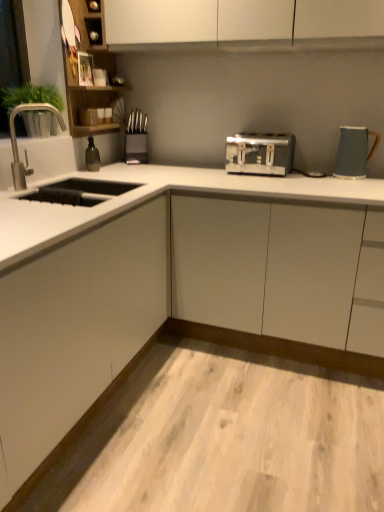
Question: From the image's perspective, is satin silver toaster at center located above or below white laminate countertop at lower center?

Choices:
 (A) above
 (B) below

Answer: (A)

Question: Is point (269, 157) positioned closer to the camera than point (36, 430)?

Choices:
 (A) closer
 (B) farther

Answer: (B)

Question: Which is nearer to the wooden cabinet at upper left?

Choices:
 (A) satin silver toaster at center
 (B) metallic knife block at center
 (C) silver metallic faucet at left
 (D) white laminate countertop at lower center
 (E) white matte cabinet at lower left

Answer: (C)

Question: Estimate the real-world distances between objects in this image. Which object is farther from the white laminate countertop at lower center?

Choices:
 (A) silver metallic faucet at left
 (B) green matte plant at left
 (C) wooden cabinet at upper left
 (D) satin silver toaster at center
 (E) white matte cabinet at lower left

Answer: (C)